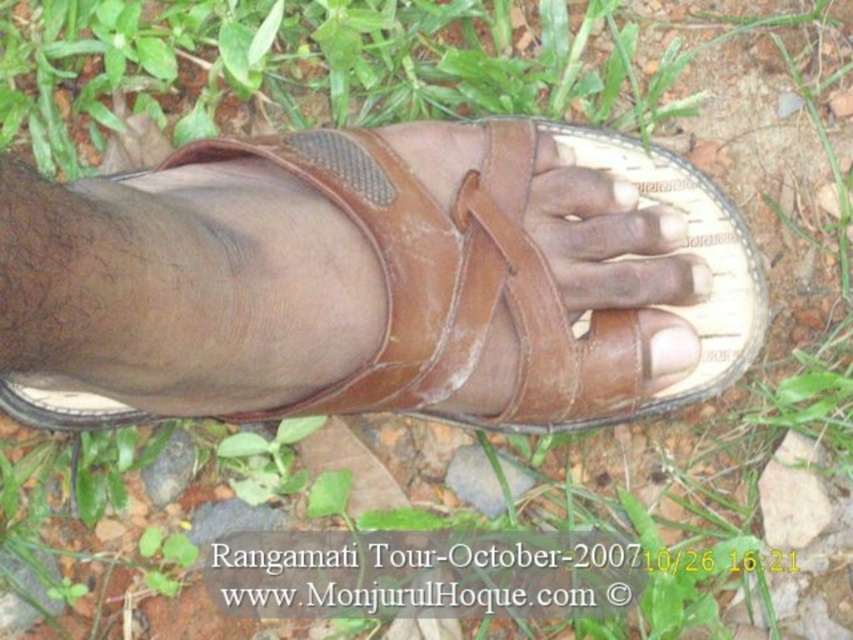
You are a fashion designer observing the brown leather sandal at center and the matte brown toe at center. Which object is higher in the image?

The brown leather sandal at center is taller than the matte brown toe at center.

You are standing in a garden and see the brown leather sandal at center and the matte brown toe at center. Which object is positioned to the left?

The brown leather sandal at center is positioned to the left of the matte brown toe at center.